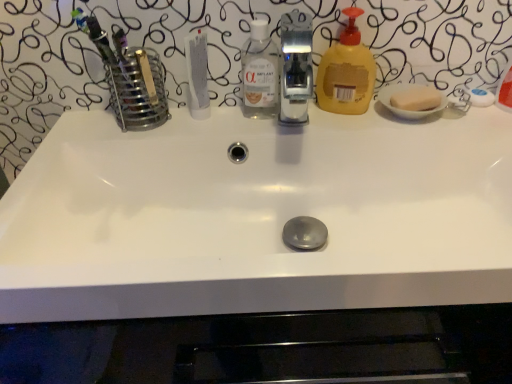
At what (x,y) coordinates should I click in order to perform the action: click on vacant space to the right of white matte tube at center. Please return your answer as a coordinate pair (x, y). The height and width of the screenshot is (384, 512). Looking at the image, I should click on (278, 122).